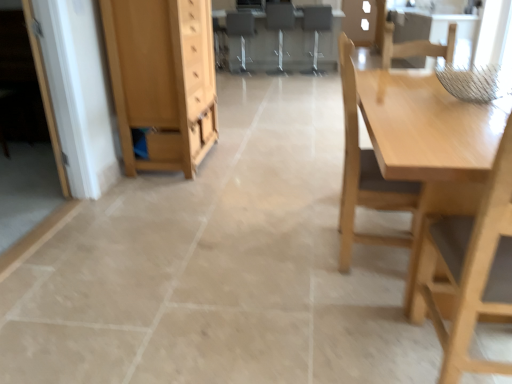
Question: From a real-world perspective, is light wood chair at right, the third chair from the right, located higher than metallic silver chair at center, which is counted as the fourth chair, starting from the right?

Choices:
 (A) no
 (B) yes

Answer: (A)

Question: Does light wood chair at right, which is the third chair in left-to-right order, have a lesser width compared to metallic silver chair at center, the second chair viewed from the left?

Choices:
 (A) yes
 (B) no

Answer: (A)

Question: From the image's perspective, is light wood chair at right, the third chair from the right, below metallic silver chair at center, the second chair viewed from the left?

Choices:
 (A) no
 (B) yes

Answer: (B)

Question: Does light wood chair at right, the 5th chair in the back-to-front sequence, have a larger size compared to metallic silver chair at center, the second chair viewed from the left?

Choices:
 (A) no
 (B) yes

Answer: (A)

Question: Considering the relative sizes of light wood chair at right, which is the third chair in left-to-right order, and metallic silver chair at center, which is counted as the fourth chair, starting from the right, in the image provided, is light wood chair at right, which is the third chair in left-to-right order, wider than metallic silver chair at center, which is counted as the fourth chair, starting from the right,?

Choices:
 (A) no
 (B) yes

Answer: (A)

Question: Can you confirm if light wood chair at right, the 5th chair in the back-to-front sequence, is smaller than metallic silver chair at center, which ranks as the 2th chair in back-to-front order?

Choices:
 (A) no
 (B) yes

Answer: (B)

Question: Is light wood table at right smaller than light brown wooden chair at upper right, acting as the fifth chair starting from the left?

Choices:
 (A) no
 (B) yes

Answer: (B)

Question: Does light wood table at right have a greater width compared to light brown wooden chair at upper right, positioned as the fourth chair in back-to-front order?

Choices:
 (A) no
 (B) yes

Answer: (B)

Question: From the image's perspective, is light wood table at right over light brown wooden chair at upper right, positioned as the fourth chair in back-to-front order?

Choices:
 (A) no
 (B) yes

Answer: (A)

Question: Is light wood table at right looking in the opposite direction of light brown wooden chair at upper right, acting as the fifth chair starting from the left?

Choices:
 (A) no
 (B) yes

Answer: (A)

Question: Is light wood table at right positioned far away from light brown wooden chair at upper right, positioned as the fourth chair in back-to-front order?

Choices:
 (A) no
 (B) yes

Answer: (A)

Question: Does light wood table at right have a lesser width compared to light brown wooden chair at upper right, acting as the fifth chair starting from the left?

Choices:
 (A) no
 (B) yes

Answer: (A)

Question: From the image's perspective, is matte gray computer desk at center located beneath light brown wooden chair at upper right, positioned as the fourth chair in back-to-front order?

Choices:
 (A) yes
 (B) no

Answer: (A)